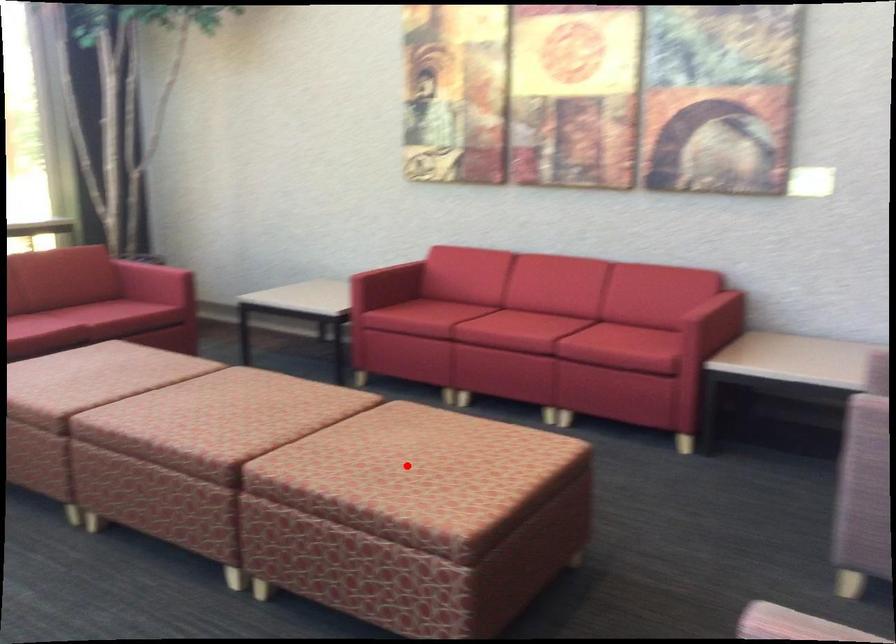
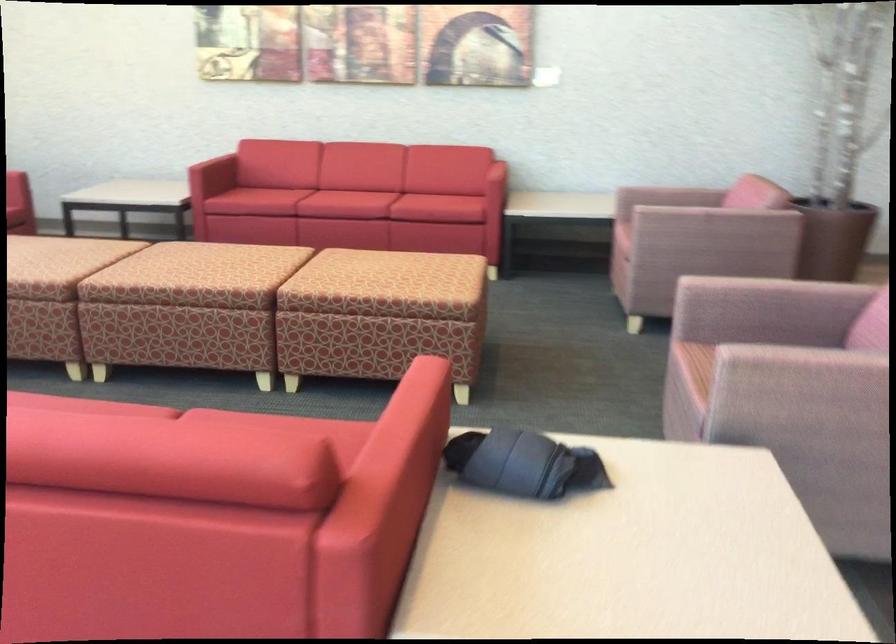
Question: A red point is marked in image1. In image2, is the corresponding 3D point closer to the camera or farther? Reply with the corresponding letter.

Choices:
 (A) The corresponding 3D point is closer.
 (B) The corresponding 3D point is farther.

Answer: (B)